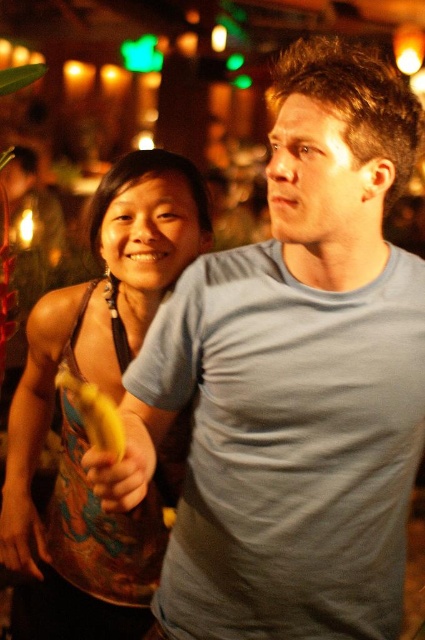
Is point (119, 394) closer to viewer compared to point (121, 454)?

That is False.

Which is more to the left, multicolored fabric dress at left or yellow matte banana at lower left?

multicolored fabric dress at left is more to the left.

Who is more forward, (112,316) or (90,444)?

Point (90,444) is more forward.

This screenshot has height=640, width=425. I want to click on multicolored fabric dress at left, so click(113, 397).